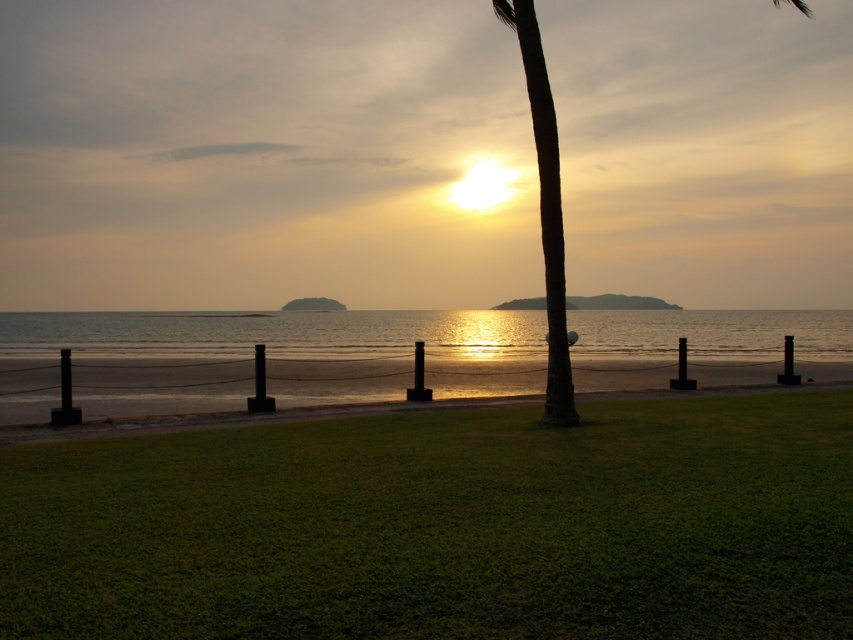
Question: Which object appears closest to the camera in this image?

Choices:
 (A) glistening water at center
 (B) green grass at center

Answer: (B)

Question: In this image, where is green grass at center located relative to glistening water at center?

Choices:
 (A) left
 (B) right

Answer: (A)

Question: Is glistening water at center above green leafy palm tree at center?

Choices:
 (A) yes
 (B) no

Answer: (B)

Question: Which of the following is the farthest from the observer?

Choices:
 (A) green grass at center
 (B) green leafy palm tree at center
 (C) glistening water at center

Answer: (C)

Question: From the image, what is the correct spatial relationship of glistening water at center in relation to green leafy palm tree at center?

Choices:
 (A) above
 (B) below

Answer: (B)

Question: Which of these objects is positioned farthest from the green leafy palm tree at center?

Choices:
 (A) glistening water at center
 (B) green grass at center

Answer: (A)